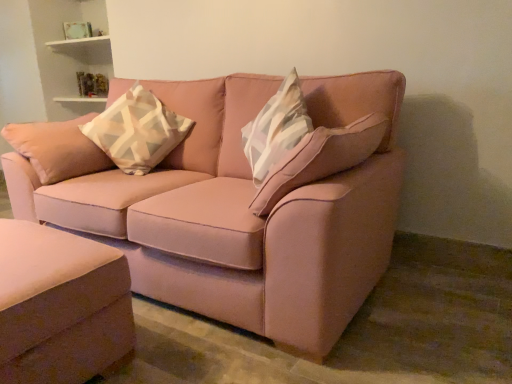
Question: Considering the relative sizes of satin pink ottoman at lower left, which ranks as the 1th studio couch in bottom-to-top order, and white and gray geometric-patterned pillow at upper left in the image provided, is satin pink ottoman at lower left, which ranks as the 1th studio couch in bottom-to-top order, thinner than white and gray geometric-patterned pillow at upper left?

Choices:
 (A) no
 (B) yes

Answer: (B)

Question: Is satin pink ottoman at lower left, which ranks as the 1th studio couch in bottom-to-top order, closer to the viewer compared to white and gray geometric-patterned pillow at upper left?

Choices:
 (A) no
 (B) yes

Answer: (B)

Question: Is satin pink ottoman at lower left, which ranks as the 1th studio couch in bottom-to-top order, at the left side of white and gray geometric-patterned pillow at upper left?

Choices:
 (A) no
 (B) yes

Answer: (B)

Question: Considering the relative sizes of satin pink ottoman at lower left, which ranks as the 1th studio couch in bottom-to-top order, and white and gray geometric-patterned pillow at upper left in the image provided, is satin pink ottoman at lower left, which ranks as the 1th studio couch in bottom-to-top order, bigger than white and gray geometric-patterned pillow at upper left?

Choices:
 (A) no
 (B) yes

Answer: (B)

Question: From a real-world perspective, is satin pink ottoman at lower left, positioned as the 2th studio couch in top-to-bottom order, physically above white and gray geometric-patterned pillow at upper left?

Choices:
 (A) yes
 (B) no

Answer: (B)

Question: Can you confirm if satin pink ottoman at lower left, which ranks as the 1th studio couch in bottom-to-top order, is smaller than white and gray geometric-patterned pillow at upper left?

Choices:
 (A) no
 (B) yes

Answer: (A)

Question: Is white and gray geometric-patterned pillow at upper left smaller than satin pink ottoman at lower left, positioned as the 2th studio couch in top-to-bottom order?

Choices:
 (A) yes
 (B) no

Answer: (A)

Question: Is white and gray geometric-patterned pillow at upper left positioned behind satin pink ottoman at lower left, positioned as the 2th studio couch in top-to-bottom order?

Choices:
 (A) yes
 (B) no

Answer: (A)

Question: From the image's perspective, is white and gray geometric-patterned pillow at upper left above satin pink ottoman at lower left, which ranks as the 1th studio couch in bottom-to-top order?

Choices:
 (A) yes
 (B) no

Answer: (A)

Question: Does white and gray geometric-patterned pillow at upper left lie in front of satin pink ottoman at lower left, which ranks as the 1th studio couch in bottom-to-top order?

Choices:
 (A) no
 (B) yes

Answer: (A)

Question: Is white and gray geometric-patterned pillow at upper left turned away from satin pink ottoman at lower left, which ranks as the 1th studio couch in bottom-to-top order?

Choices:
 (A) yes
 (B) no

Answer: (B)

Question: Does white and gray geometric-patterned pillow at upper left touch satin pink ottoman at lower left, positioned as the 2th studio couch in top-to-bottom order?

Choices:
 (A) no
 (B) yes

Answer: (A)

Question: From the image's perspective, would you say white and gray geometric-patterned pillow at upper left is positioned over matte pink fabric couch at center, which is counted as the 2th studio couch, starting from the bottom?

Choices:
 (A) no
 (B) yes

Answer: (B)